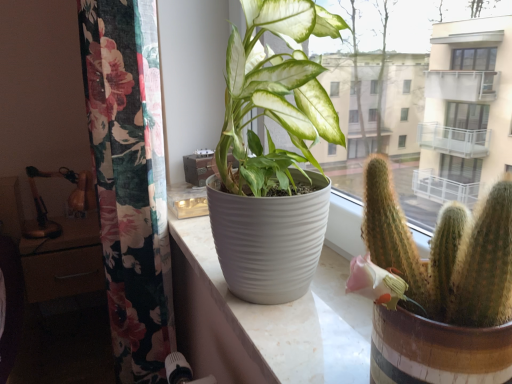
I want to click on matte brown drawer at left, so click(64, 261).

What do you see at coordinates (129, 183) in the screenshot? I see `floral fabric curtain at left` at bounding box center [129, 183].

The height and width of the screenshot is (384, 512). In order to click on white ribbed pot at center in this screenshot , I will do `click(266, 321)`.

Who is taller, white ribbed pot at center or matte brown drawer at left?

Standing taller between the two is matte brown drawer at left.

Looking at this image, considering the relative sizes of white ribbed pot at center and matte brown drawer at left in the image provided, is white ribbed pot at center bigger than matte brown drawer at left?

No, white ribbed pot at center is not bigger than matte brown drawer at left.

From a real-world perspective, between white ribbed pot at center and matte brown drawer at left, who is vertically lower?

matte brown drawer at left, from a real-world perspective.

From the image's perspective, relative to matte brown drawer at left, is white ribbed pot at center above or below?

Based on their image positions, white ribbed pot at center is located above matte brown drawer at left.

Are white ribbed pot at center and floral fabric curtain at left beside each other?

No, white ribbed pot at center is not with floral fabric curtain at left.

This screenshot has width=512, height=384. In order to click on counter top on the right of the floral fabric curtain at left in this screenshot , I will do `click(266, 321)`.

Is white ribbed pot at center at the right side of floral fabric curtain at left?

Indeed, white ribbed pot at center is positioned on the right side of floral fabric curtain at left.

From the image's perspective, is white ribbed pot at center located above or below green spiky cactus at right?

Based on their image positions, white ribbed pot at center is located beneath green spiky cactus at right.

From a real-world perspective, is white ribbed pot at center beneath green spiky cactus at right?

Correct, in the physical world, white ribbed pot at center is lower than green spiky cactus at right.

Would you say white ribbed pot at center is outside green spiky cactus at right?

Absolutely, white ribbed pot at center is external to green spiky cactus at right.

Is point (163, 355) positioned behind point (52, 266)?

No, (163, 355) is closer to viewer.

What's the angular difference between floral fabric curtain at left and matte brown drawer at left's facing directions?

They differ by 89.4 degrees in their facing directions.

Is floral fabric curtain at left spatially inside matte brown drawer at left, or outside of it?

floral fabric curtain at left is outside matte brown drawer at left.

From a real-world perspective, does floral fabric curtain at left sit lower than matte brown drawer at left?

No, from a real-world perspective, floral fabric curtain at left is not below matte brown drawer at left.

Looking at this image, which is in front, green spiky cactus at right or floral fabric curtain at left?

green spiky cactus at right.

Does green spiky cactus at right have a greater width compared to floral fabric curtain at left?

No.

Between green spiky cactus at right and floral fabric curtain at left, which one has smaller size?

green spiky cactus at right.

In the image, there is a floral fabric curtain at left. Where is `houseplant above it (from the image's perspective)`? This screenshot has height=384, width=512. houseplant above it (from the image's perspective) is located at coordinates (442, 288).

In the scene shown: From the image's perspective, is matte brown drawer at left below white ribbed pot at center?

Correct, matte brown drawer at left appears lower than white ribbed pot at center in the image.

Which is further, (x=95, y=281) or (x=291, y=357)?

Positioned behind is point (x=95, y=281).

From a real-world perspective, between matte brown drawer at left and white ribbed pot at center, who is vertically higher?

From a 3D spatial view, white ribbed pot at center is above.

Can you confirm if matte brown drawer at left is bigger than floral fabric curtain at left?

Actually, matte brown drawer at left might be smaller than floral fabric curtain at left.

How many degrees apart are the facing directions of matte brown drawer at left and floral fabric curtain at left?

The facing directions of matte brown drawer at left and floral fabric curtain at left are 89.4 degrees apart.

Is matte brown drawer at left in front of or behind floral fabric curtain at left in the image?

Clearly, matte brown drawer at left is behind floral fabric curtain at left.

Looking at their sizes, would you say matte brown drawer at left is wider or thinner than floral fabric curtain at left?

In the image, matte brown drawer at left appears to be wider than floral fabric curtain at left.

Find the location of a particular element. table lying below the white ribbed pot at center (from the image's perspective) is located at coordinates (64, 261).

Where is `curtain directly beneath the white ribbed pot at center (from a real-world perspective)`? Image resolution: width=512 pixels, height=384 pixels. curtain directly beneath the white ribbed pot at center (from a real-world perspective) is located at coordinates (129, 183).

From the image, which object appears to be farther from matte brown drawer at left, white ribbed pot at center or green spiky cactus at right?

green spiky cactus at right is positioned further to the anchor matte brown drawer at left.

When comparing their distances from floral fabric curtain at left, does matte brown drawer at left or white ribbed pot at center seem further?

Based on the image, matte brown drawer at left appears to be further to floral fabric curtain at left.

When comparing their distances from floral fabric curtain at left, does matte brown drawer at left or green spiky cactus at right seem further?

Based on the image, matte brown drawer at left appears to be further to floral fabric curtain at left.

From the picture: Which object lies nearer to the anchor point green spiky cactus at right, white ribbed pot at center or matte brown drawer at left?

white ribbed pot at center lies closer to green spiky cactus at right than the other object.

Estimate the real-world distances between objects in this image. Which object is closer to green spiky cactus at right, white ribbed pot at center or floral fabric curtain at left?

The object closer to green spiky cactus at right is white ribbed pot at center.

When comparing their distances from white ribbed pot at center, does floral fabric curtain at left or green spiky cactus at right seem closer?

floral fabric curtain at left is closer to white ribbed pot at center.

Considering their positions, is floral fabric curtain at left positioned closer to green spiky cactus at right than matte brown drawer at left?

floral fabric curtain at left is closer to green spiky cactus at right.

Estimate the real-world distances between objects in this image. Which object is closer to white ribbed pot at center, matte brown drawer at left or green spiky cactus at right?

Among the two, green spiky cactus at right is located nearer to white ribbed pot at center.

Where is `curtain between white ribbed pot at center and matte brown drawer at left in the front-back direction`? This screenshot has height=384, width=512. curtain between white ribbed pot at center and matte brown drawer at left in the front-back direction is located at coordinates (129, 183).

At what (x,y) coordinates should I click in order to perform the action: click on counter top between green spiky cactus at right and matte brown drawer at left from front to back. Please return your answer as a coordinate pair (x, y). Looking at the image, I should click on click(266, 321).

Where is `counter top between floral fabric curtain at left and green spiky cactus at right from left to right`? counter top between floral fabric curtain at left and green spiky cactus at right from left to right is located at coordinates (266, 321).

I want to click on curtain located between green spiky cactus at right and matte brown drawer at left in the depth direction, so click(x=129, y=183).